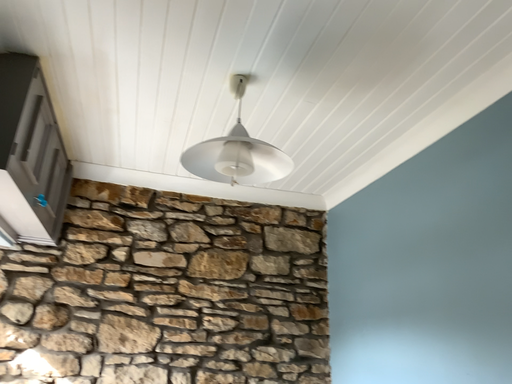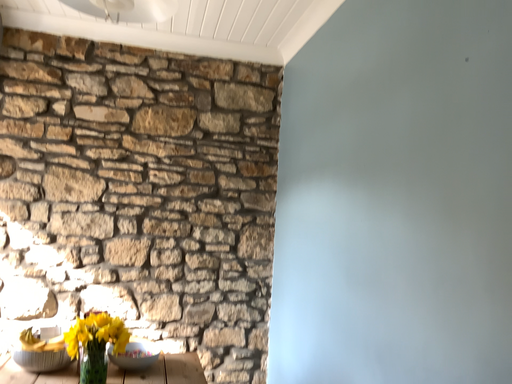
Question: How did the camera likely rotate when shooting the video?

Choices:
 (A) rotated upward
 (B) rotated downward

Answer: (B)